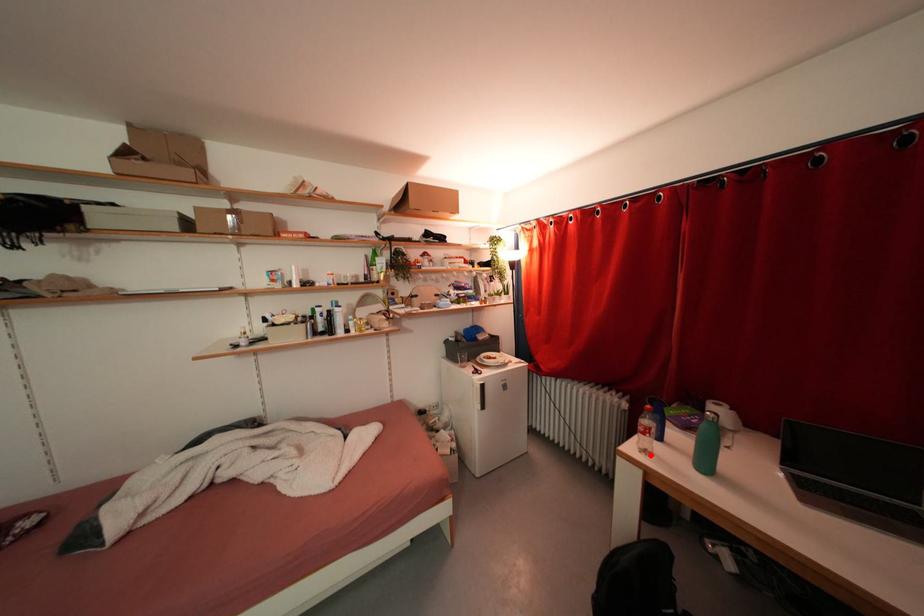
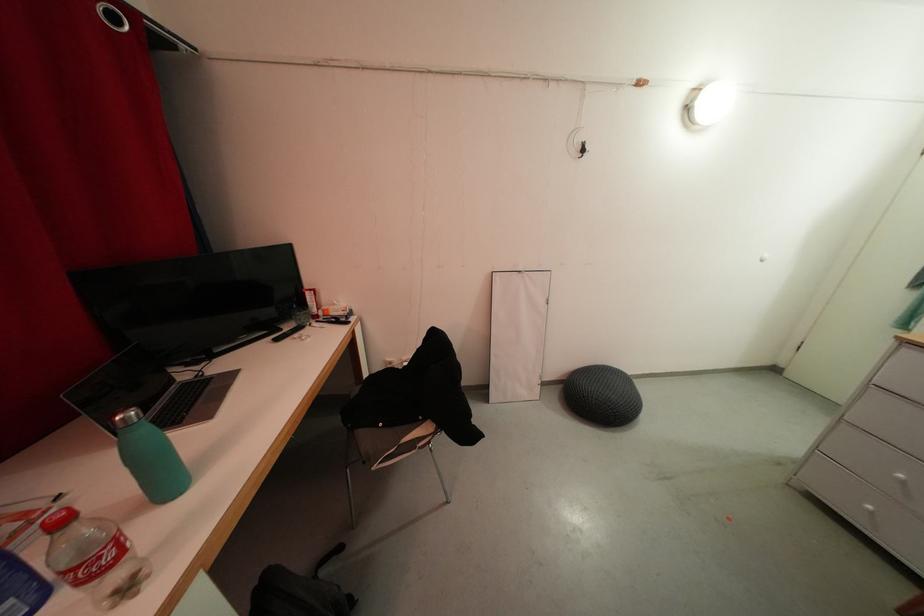
Question: I am providing you with two images of the same scene from different viewpoints. A red point is marked on the first image. Can you still see the location of the red point in image 2?

Choices:
 (A) Yes
 (B) No

Answer: (A)